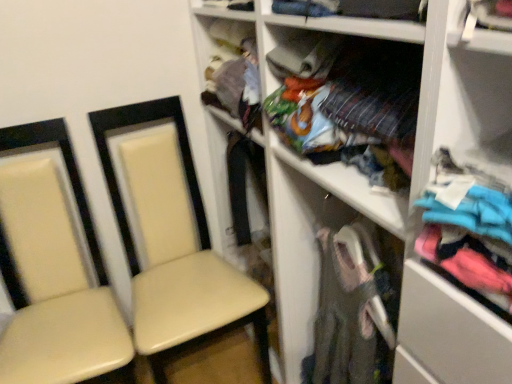
Question: Is turquoise fabric shirt at right, the first clothing positioned from the front, at the back of beige leather chair at left, placed as the first chair when sorted from right to left?

Choices:
 (A) no
 (B) yes

Answer: (A)

Question: From the image's perspective, is beige leather chair at left, which is the second chair from left to right, under turquoise fabric shirt at right, which is counted as the second clothing, starting from the back?

Choices:
 (A) yes
 (B) no

Answer: (A)

Question: Does beige leather chair at left, which is the second chair from left to right, appear on the right side of turquoise fabric shirt at right, which is counted as the second clothing, starting from the back?

Choices:
 (A) yes
 (B) no

Answer: (B)

Question: Does beige leather chair at left, which is the second chair from left to right, have a smaller size compared to turquoise fabric shirt at right, which is counted as the second clothing, starting from the back?

Choices:
 (A) yes
 (B) no

Answer: (B)

Question: Can you confirm if beige leather chair at left, which is the second chair from left to right, is shorter than turquoise fabric shirt at right, which is counted as the second clothing, starting from the back?

Choices:
 (A) yes
 (B) no

Answer: (B)

Question: In the image, is matte white shelf at center positioned in front of or behind textured fabric clothing at upper center?

Choices:
 (A) front
 (B) behind

Answer: (A)

Question: In terms of size, does matte white shelf at center appear bigger or smaller than textured fabric clothing at upper center?

Choices:
 (A) big
 (B) small

Answer: (A)

Question: Considering the relative positions of matte white shelf at center and textured fabric clothing at upper center in the image provided, is matte white shelf at center to the left or to the right of textured fabric clothing at upper center?

Choices:
 (A) right
 (B) left

Answer: (A)

Question: From a real-world perspective, is matte white shelf at center physically located above or below textured fabric clothing at upper center?

Choices:
 (A) below
 (B) above

Answer: (A)

Question: From the image's perspective, relative to multicolored fabric at center, acting as the 2th clothing starting from the front, is turquoise fabric shirt at right, which is counted as the second clothing, starting from the back, above or below?

Choices:
 (A) above
 (B) below

Answer: (B)

Question: Visually, is turquoise fabric shirt at right, the first clothing positioned from the front, positioned to the left or to the right of multicolored fabric at center, acting as the 2th clothing starting from the front?

Choices:
 (A) left
 (B) right

Answer: (B)

Question: Considering the positions of turquoise fabric shirt at right, the first clothing positioned from the front, and multicolored fabric at center, acting as the 1th clothing starting from the back, in the image, is turquoise fabric shirt at right, the first clothing positioned from the front, bigger or smaller than multicolored fabric at center, acting as the 1th clothing starting from the back,?

Choices:
 (A) big
 (B) small

Answer: (B)

Question: In terms of width, does turquoise fabric shirt at right, which is counted as the second clothing, starting from the back, look wider or thinner when compared to multicolored fabric at center, acting as the 1th clothing starting from the back?

Choices:
 (A) thin
 (B) wide

Answer: (A)

Question: In the image, is textured fabric clothing at upper center positioned in front of or behind turquoise fabric shirt at right, which is counted as the second clothing, starting from the back?

Choices:
 (A) behind
 (B) front

Answer: (A)

Question: Is textured fabric clothing at upper center inside or outside of turquoise fabric shirt at right, the first clothing positioned from the front?

Choices:
 (A) outside
 (B) inside

Answer: (A)